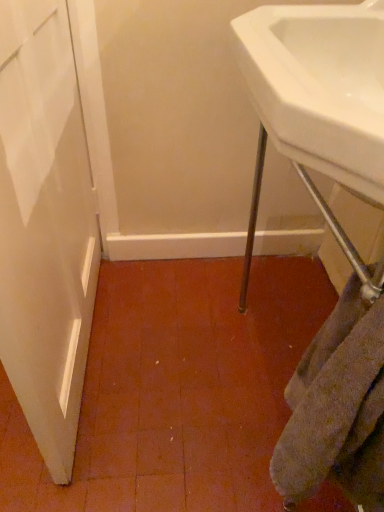
Question: Can you confirm if white glossy sink at upper right is thinner than gray textured towel at lower right?

Choices:
 (A) no
 (B) yes

Answer: (A)

Question: Can you confirm if white glossy sink at upper right is bigger than gray textured towel at lower right?

Choices:
 (A) yes
 (B) no

Answer: (A)

Question: Is the position of white glossy sink at upper right more distant than that of gray textured towel at lower right?

Choices:
 (A) yes
 (B) no

Answer: (B)

Question: Are white glossy sink at upper right and gray textured towel at lower right beside each other?

Choices:
 (A) no
 (B) yes

Answer: (A)

Question: Considering the relative sizes of white glossy sink at upper right and gray textured towel at lower right in the image provided, is white glossy sink at upper right taller than gray textured towel at lower right?

Choices:
 (A) no
 (B) yes

Answer: (A)

Question: Is white glossy sink at upper right shorter than gray textured towel at lower right?

Choices:
 (A) yes
 (B) no

Answer: (A)

Question: Is gray textured towel at lower right positioned with its back to white glossy sink at upper right?

Choices:
 (A) yes
 (B) no

Answer: (B)

Question: Could you tell me if gray textured towel at lower right is turned towards white glossy sink at upper right?

Choices:
 (A) no
 (B) yes

Answer: (A)

Question: Considering the relative sizes of gray textured towel at lower right and white glossy sink at upper right in the image provided, is gray textured towel at lower right bigger than white glossy sink at upper right?

Choices:
 (A) no
 (B) yes

Answer: (A)

Question: Is gray textured towel at lower right wider than white glossy sink at upper right?

Choices:
 (A) no
 (B) yes

Answer: (A)

Question: Is gray textured towel at lower right at the left side of white glossy sink at upper right?

Choices:
 (A) yes
 (B) no

Answer: (A)

Question: From the image's perspective, is gray textured towel at lower right located above white glossy sink at upper right?

Choices:
 (A) yes
 (B) no

Answer: (B)

Question: Based on their sizes in the image, would you say white glossy sink at upper right is bigger or smaller than gray textured towel at lower right?

Choices:
 (A) big
 (B) small

Answer: (A)